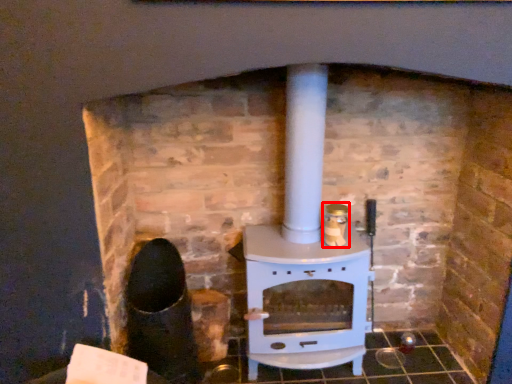
Question: From the image's perspective, where is appliance (annotated by the red box) located relative to wood burning stove?

Choices:
 (A) above
 (B) below

Answer: (A)